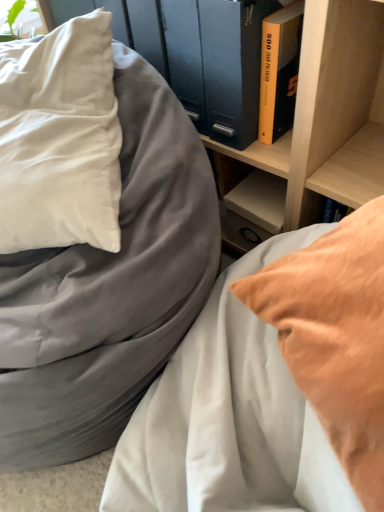
I want to click on yellow matte book at upper right, so click(232, 66).

Locate an element on the screen. Image resolution: width=384 pixels, height=512 pixels. yellow matte book at upper right is located at coordinates (232, 66).

From the image's perspective, between white satin pillow at left and matte gray bed at center, the 2th bed from the right, who is located below?

From the image's view, matte gray bed at center, the 2th bed from the right, is below.

Which is closer, (102,163) or (83,307)?

Point (102,163) is farther from the camera than point (83,307).

Consider the image. Could you tell me if white satin pillow at left is facing matte gray bed at center, the 2th bed from the right?

Yes, white satin pillow at left is aimed at matte gray bed at center, the 2th bed from the right.

From a real-world perspective, is matte gray bed at center, which is counted as the first bed, starting from the right, physically located above or below yellow matte book at upper right?

In terms of real-world spatial position, matte gray bed at center, which is counted as the first bed, starting from the right, is below yellow matte book at upper right.

Is matte gray bed at center, acting as the second bed starting from the left, in front of or behind yellow matte book at upper right in the image?

In the image, matte gray bed at center, acting as the second bed starting from the left, appears in front of yellow matte book at upper right.

From the image's perspective, which one is positioned lower, matte gray bed at center, acting as the second bed starting from the left, or yellow matte book at upper right?

matte gray bed at center, acting as the second bed starting from the left, appears lower in the image.

Considering the sizes of objects matte gray bed at center, acting as the second bed starting from the left, and yellow matte book at upper right in the image provided, who is bigger, matte gray bed at center, acting as the second bed starting from the left, or yellow matte book at upper right?

Bigger between the two is matte gray bed at center, acting as the second bed starting from the left.

From a real-world perspective, who is located lower, yellow hardcover book at upper right or yellow matte book at upper right?

yellow hardcover book at upper right, from a real-world perspective.

Can you confirm if yellow hardcover book at upper right is taller than yellow matte book at upper right?

Incorrect, the height of yellow hardcover book at upper right is not larger of that of yellow matte book at upper right.

From the image's perspective, who appears lower, yellow hardcover book at upper right or yellow matte book at upper right?

yellow hardcover book at upper right, from the image's perspective.

Is yellow hardcover book at upper right positioned in front of yellow matte book at upper right?

No, it is not.

From their relative heights in the image, would you say matte gray bed at center, the 2th bed from the right, is taller or shorter than yellow matte book at upper right?

matte gray bed at center, the 2th bed from the right, is taller than yellow matte book at upper right.

Is matte gray bed at center, the 2th bed from the right, positioned with its back to yellow matte book at upper right?

Yes, yellow matte book at upper right is at the back of matte gray bed at center, the 2th bed from the right.

From the image's perspective, between matte gray bed at center, which is the first bed in left-to-right order, and yellow matte book at upper right, who is located below?

matte gray bed at center, which is the first bed in left-to-right order, from the image's perspective.

Is matte gray bed at center, the 2th bed from the right, directly adjacent to yellow matte book at upper right?

matte gray bed at center, the 2th bed from the right, and yellow matte book at upper right are not in contact.

Is there a large distance between white satin pillow at left and yellow hardcover book at upper right?

No, white satin pillow at left is not far away from yellow hardcover book at upper right.

From their relative heights in the image, would you say white satin pillow at left is taller or shorter than yellow hardcover book at upper right?

In the image, white satin pillow at left appears to be taller than yellow hardcover book at upper right.

Is white satin pillow at left bigger than yellow hardcover book at upper right?

Correct, white satin pillow at left is larger in size than yellow hardcover book at upper right.

Which object is positioned more to the right, white satin pillow at left or yellow hardcover book at upper right?

yellow hardcover book at upper right is more to the right.

Is yellow matte book at upper right not near wooden shelf at upper center?

No, there isn't a large distance between yellow matte book at upper right and wooden shelf at upper center.

From the image's perspective, relative to wooden shelf at upper center, is yellow matte book at upper right above or below?

Based on their image positions, yellow matte book at upper right is located above wooden shelf at upper center.

This screenshot has height=512, width=384. I want to click on shelf on the left side of yellow matte book at upper right, so 319,124.

Which object is thinner, yellow matte book at upper right or wooden shelf at upper center?

→ yellow matte book at upper right.

In the scene shown: Who is taller, yellow matte book at upper right or white satin pillow at left?

white satin pillow at left is taller.

Considering the positions of points (251, 113) and (24, 155), is point (251, 113) farther from camera compared to point (24, 155)?

Yes, it is.

Looking at the image, does yellow matte book at upper right seem bigger or smaller compared to white satin pillow at left?

Clearly, yellow matte book at upper right is smaller in size than white satin pillow at left.

How different are the orientations of yellow matte book at upper right and white satin pillow at left in degrees?

There is a 46.5-degree angle between the facing directions of yellow matte book at upper right and white satin pillow at left.

The height and width of the screenshot is (512, 384). I want to click on the 1st bed positioned below the white satin pillow at left (from the image's perspective), so click(93, 238).

What are the coordinates of `paperback book behind the matte gray bed at center, which is counted as the first bed, starting from the right` in the screenshot? It's located at (232, 66).

Based on their spatial positions, is matte gray bed at center, which is the first bed in left-to-right order, or yellow hardcover book at upper right closer to wooden shelf at upper center?

The object closer to wooden shelf at upper center is yellow hardcover book at upper right.

Estimate the real-world distances between objects in this image. Which object is closer to matte gray bed at center, which is the first bed in left-to-right order, yellow hardcover book at upper right or yellow matte book at upper right?

Among the two, yellow matte book at upper right is located nearer to matte gray bed at center, which is the first bed in left-to-right order.

Based on their spatial positions, is yellow matte book at upper right or wooden shelf at upper center further from matte gray bed at center, which is the first bed in left-to-right order?

wooden shelf at upper center is further to matte gray bed at center, which is the first bed in left-to-right order.

Which object lies further to the anchor point matte gray bed at center, the 2th bed from the right, white satin pillow at left or yellow hardcover book at upper right?

yellow hardcover book at upper right lies further to matte gray bed at center, the 2th bed from the right, than the other object.

Looking at the image, which one is located further to yellow matte book at upper right, matte gray bed at center, the 2th bed from the right, or white satin pillow at left?

Based on the image, matte gray bed at center, the 2th bed from the right, appears to be further to yellow matte book at upper right.

When comparing their distances from matte gray bed at center, which is the first bed in left-to-right order, does wooden shelf at upper center or matte gray bed at center, which is counted as the first bed, starting from the right, seem further?

Based on the image, wooden shelf at upper center appears to be further to matte gray bed at center, which is the first bed in left-to-right order.

Looking at the image, which one is located closer to white satin pillow at left, yellow matte book at upper right or wooden shelf at upper center?

yellow matte book at upper right lies closer to white satin pillow at left than the other object.

Which object lies nearer to the anchor point wooden shelf at upper center, matte gray bed at center, which is the first bed in left-to-right order, or white satin pillow at left?

Among the two, matte gray bed at center, which is the first bed in left-to-right order, is located nearer to wooden shelf at upper center.

You are a GUI agent. You are given a task and a screenshot of the screen. Output one action in this format:
    pyautogui.click(x=<x>, y=<y>)
    Task: Click on the pillow located between matte gray bed at center, which is the first bed in left-to-right order, and yellow hardcover book at upper right in the left-right direction
    
    Given the screenshot: What is the action you would take?
    pyautogui.click(x=60, y=139)

I want to click on shelf situated between matte gray bed at center, the 2th bed from the right, and yellow matte book at upper right from left to right, so click(319, 124).

The height and width of the screenshot is (512, 384). What are the coordinates of `bed between matte gray bed at center, the 2th bed from the right, and yellow hardcover book at upper right` in the screenshot? It's located at (271, 386).

Image resolution: width=384 pixels, height=512 pixels. I want to click on shelf that lies between yellow matte book at upper right and matte gray bed at center, acting as the second bed starting from the left, from top to bottom, so click(319, 124).